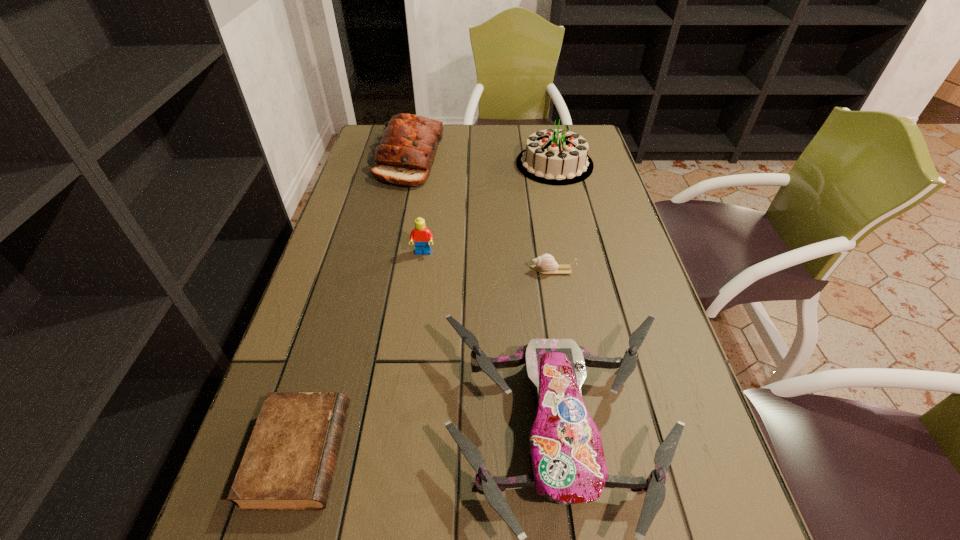
This screenshot has height=540, width=960. Find the location of `the tallest object`. the tallest object is located at coordinates (558, 157).

Image resolution: width=960 pixels, height=540 pixels. I want to click on bread, so [409, 143].

Locate an element on the screen. This screenshot has height=540, width=960. Lego is located at coordinates (422, 236).

This screenshot has height=540, width=960. I want to click on diary, so click(x=288, y=465).

Identify the location of the third nearest object. The image size is (960, 540). 545,264.

Image resolution: width=960 pixels, height=540 pixels. What are the coordinates of `free space located on the front of the tallest object` in the screenshot? It's located at (566, 218).

Where is `vacant space located on the front of the bread`? The width and height of the screenshot is (960, 540). vacant space located on the front of the bread is located at coordinates (396, 221).

Find the location of `vacant area situated on the face of the third farthest object`. vacant area situated on the face of the third farthest object is located at coordinates (414, 323).

Find the location of a particular element. The width and height of the screenshot is (960, 540). vacant position located on the spine side of the diary is located at coordinates (452, 454).

Identify the location of free space located 0.320m on the shell of the third nearest object. The width and height of the screenshot is (960, 540). (399, 271).